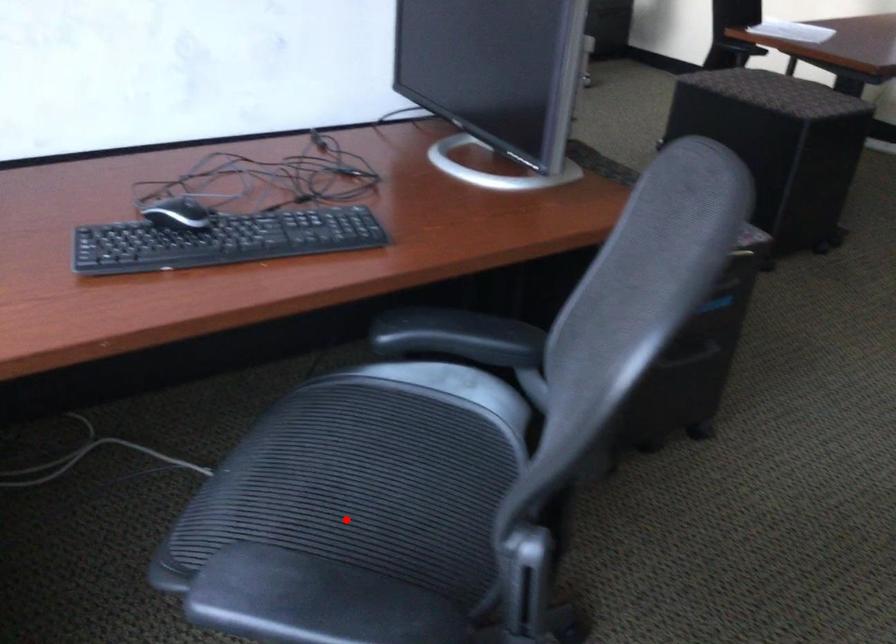
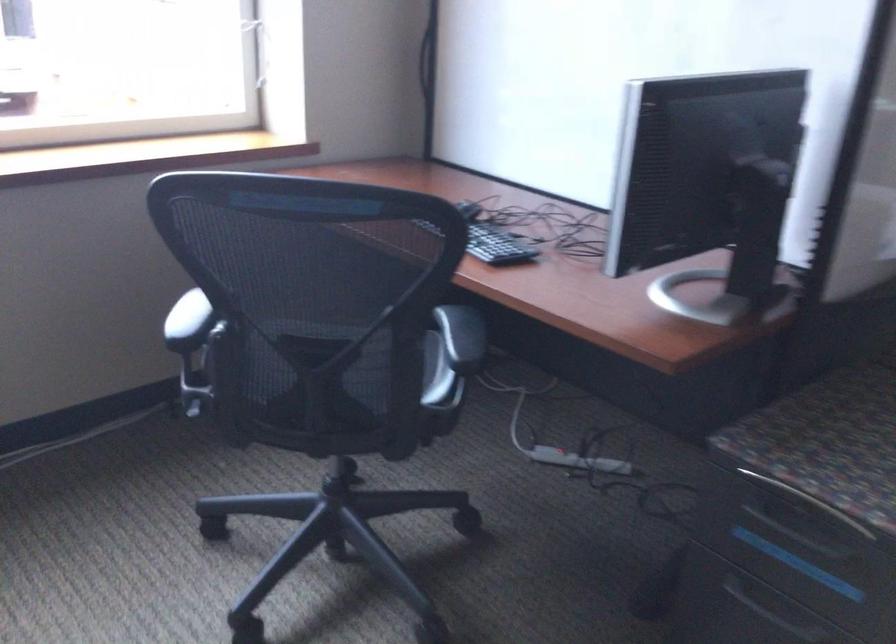
Question: I am providing you with two images of the same scene from different viewpoints. A red point is marked on the first image. Is the red point's position out of view in image 2?

Choices:
 (A) Yes
 (B) No

Answer: (A)